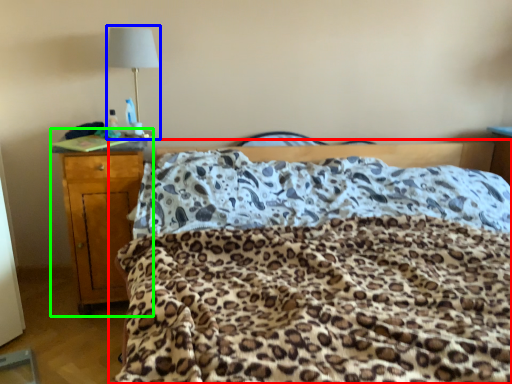
Question: Which object is positioned farthest from bed (highlighted by a red box)? Select from lamp (highlighted by a blue box) and nightstand (highlighted by a green box).

Choices:
 (A) lamp
 (B) nightstand

Answer: (A)